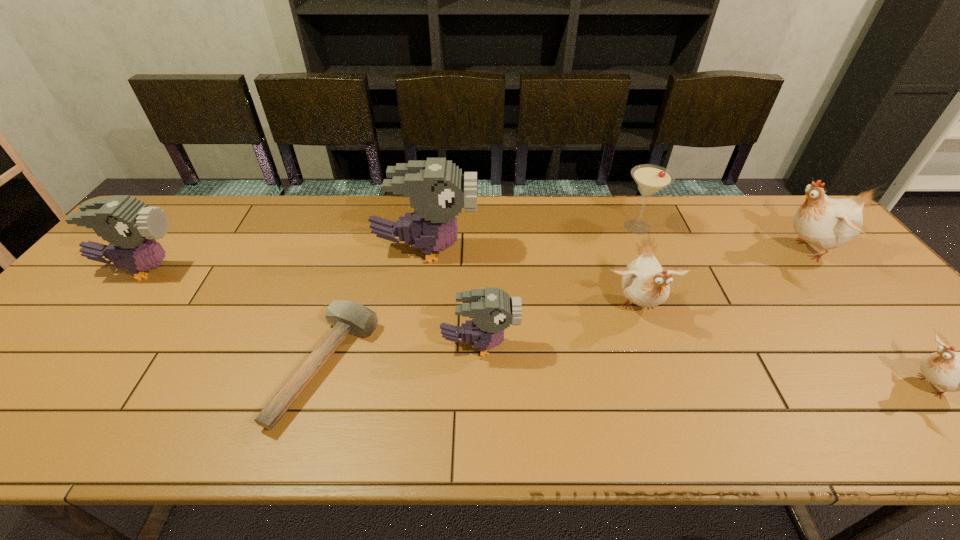
The height and width of the screenshot is (540, 960). I want to click on the biggest gray bird, so click(437, 189).

What are the coordinates of `the biggest white bird` in the screenshot? It's located at (826, 223).

In order to click on the leftmost object in this screenshot , I will do `click(130, 226)`.

Identify the location of the second biggest gray bird. (130, 226).

The image size is (960, 540). I want to click on martini, so click(650, 179).

At what (x,y) coordinates should I click in order to perform the action: click on the leftmost white bird. Please return your answer as a coordinate pair (x, y). Looking at the image, I should click on (645, 283).

Locate an element on the screen. The image size is (960, 540). the third bird from right to left is located at coordinates (645, 283).

Identify the location of the nearest gray bird. (493, 310).

At what (x,y) coordinates should I click in order to perform the action: click on the shortest object. Please return your answer as a coordinate pair (x, y). Looking at the image, I should click on (347, 317).

Find the location of a particular element. This screenshot has width=960, height=540. gray mallet is located at coordinates (347, 317).